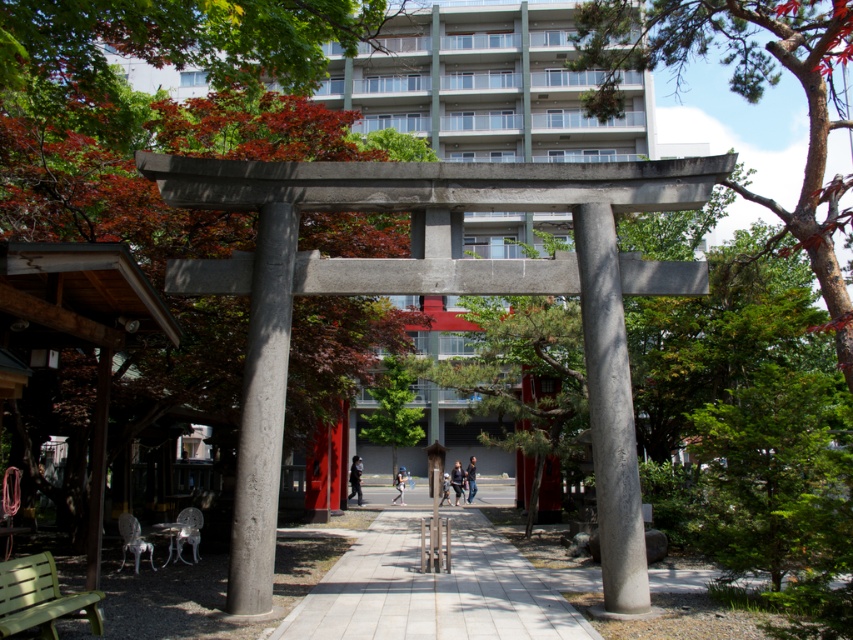
You are a visitor at a Shinto shrine and notice a dark gray concrete statue at center and a light blue fabric at center. Which object is placed above the other?

The dark gray concrete statue at center is positioned over the light blue fabric at center, meaning it is placed above the fabric.

You are standing at the base of the torii gate and want to walk towards the red torii gate further down the pathway. Which point, point (358, 472) or point (401, 488), would you encounter first along your path?

Point (358, 472) is closer to the viewer than point (401, 488), so you would encounter point (358, 472) first along your path.

You are a photographer setting up a tripod in the middle of the pathway between the two torii gates. You notice a dark gray fabric jacket at center and a light blue fabric at center lying on the ground. Which item should you avoid placing your tripod on to ensure stability?

The dark gray fabric jacket at center has a larger width than the light blue fabric at center, so placing the tripod on the dark gray fabric jacket at center would provide more stability due to its greater size.